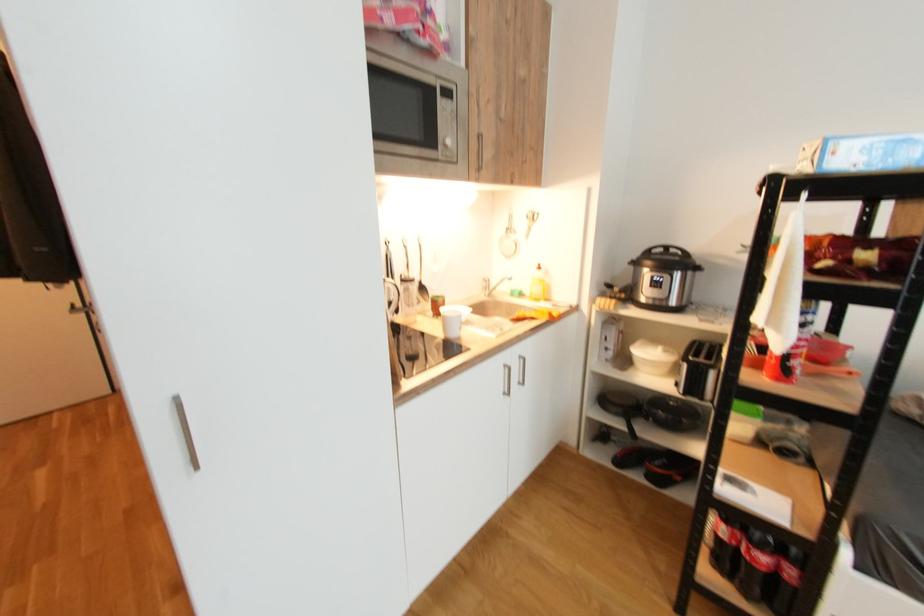
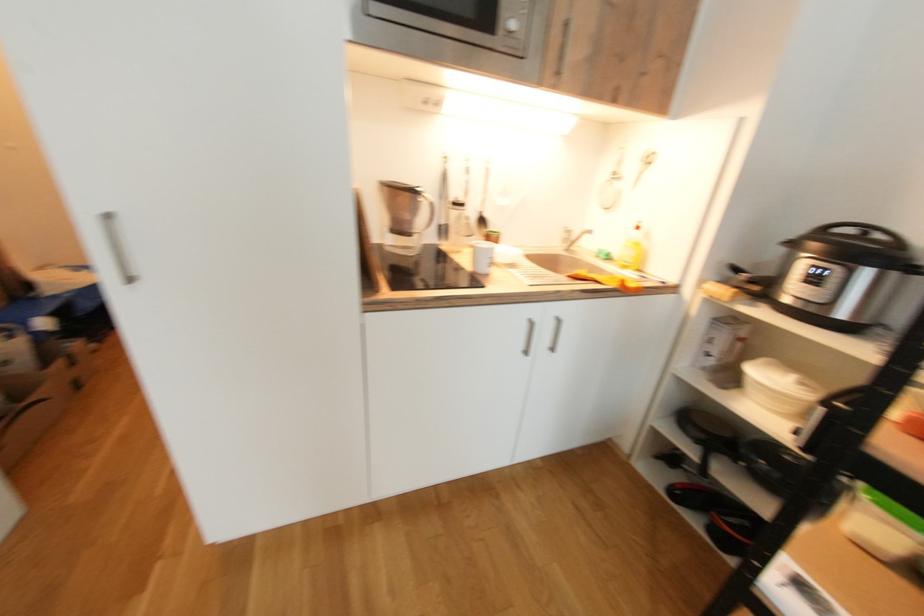
What movement of the cameraman would produce the second image?

The movement direction of the cameraman is right, forward.